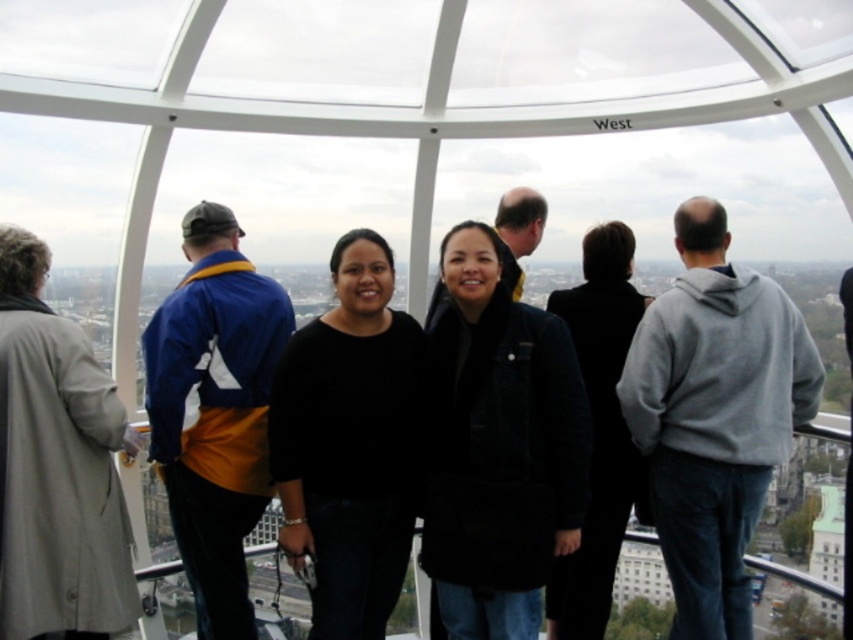
You are a photographer trying to capture a photo of both the black denim jacket at center and the black wool coat at center. Since you want to ensure both are clearly visible, which one should you focus on first to make sure it is in sharp focus, considering their sizes?

The black denim jacket at center is bigger than the black wool coat at center, so you should focus on the black denim jacket at center first to ensure it is in sharp focus since it covers more of the frame.

You are standing on the observation deck and want to take a photo of the black denim jacket at center and the black matte sweater at center. Which one is closer to the camera?

The black denim jacket at center is in front of the black matte sweater at center, so it is closer to the camera.